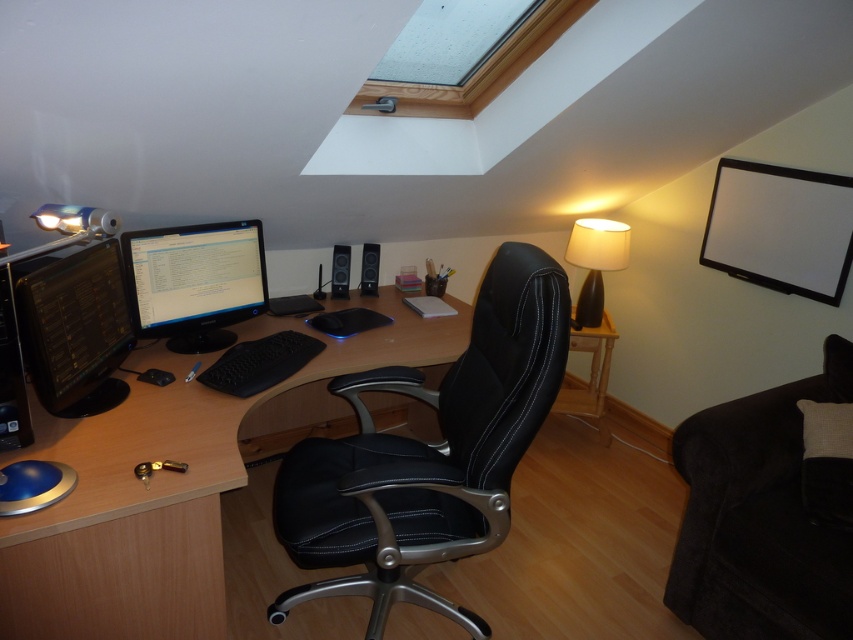
Is black leather office chair at center thinner than satin black monitor at center?

Incorrect, black leather office chair at center's width is not less than satin black monitor at center's.

Who is more distant from viewer, [485,333] or [218,316]?

Point [218,316]

Where is `black leather office chair at center`? This screenshot has width=853, height=640. black leather office chair at center is located at coordinates (428, 452).

Which is behind, point (396, 449) or point (339, 248)?

Point (339, 248)

Is the position of black leather office chair at center more distant than that of black plastic speaker at center?

No, black leather office chair at center is closer to the viewer.

Is point (364, 552) farther from camera compared to point (334, 284)?

No, (364, 552) is in front of (334, 284).

The image size is (853, 640). What are the coordinates of `black leather office chair at center` in the screenshot? It's located at (428, 452).

Can you confirm if black leather swivel chair at center is wider than white fabric lampshade at upper right?

Correct, the width of black leather swivel chair at center exceeds that of white fabric lampshade at upper right.

Based on the photo, does black leather swivel chair at center have a greater height compared to white fabric lampshade at upper right?

Indeed, black leather swivel chair at center has a greater height compared to white fabric lampshade at upper right.

Is point (718, 540) positioned in front of point (583, 316)?

Yes, it is in front of point (583, 316).

Where is `black leather swivel chair at center`? The image size is (853, 640). black leather swivel chair at center is located at coordinates (759, 518).